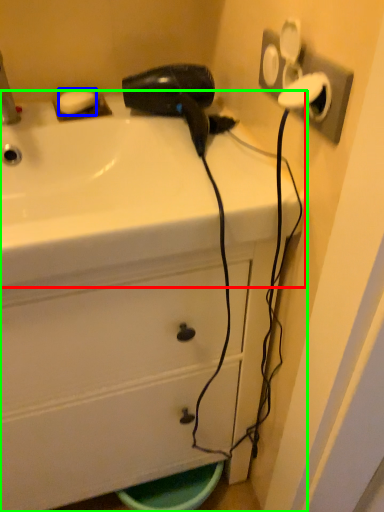
Question: Based on their relative distances, which object is nearer to sink (highlighted by a red box)? Choose from soap (highlighted by a blue box) and bathroom cabinet (highlighted by a green box).

Choices:
 (A) soap
 (B) bathroom cabinet

Answer: (B)